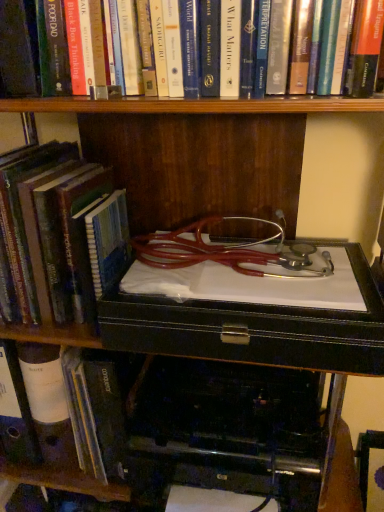
Describe the element at coordinates (255, 328) in the screenshot. The image size is (384, 512). I see `black plastic printer at lower center` at that location.

This screenshot has height=512, width=384. Describe the element at coordinates (92, 414) in the screenshot. I see `hardcover book at left, the 3th book viewed from the top` at that location.

Image resolution: width=384 pixels, height=512 pixels. Find the location of `black plastic printer at lower center`. black plastic printer at lower center is located at coordinates (255, 328).

Does hardcover book at left, which is the 1th book from bottom to top, touch hardcover book at upper center, which is the 1th book in top-to-bottom order?

No, hardcover book at left, which is the 1th book from bottom to top, is not in contact with hardcover book at upper center, which is the 1th book in top-to-bottom order.

Considering the positions of objects hardcover book at left, the 3th book viewed from the top, and hardcover book at upper center, the 3th book from the bottom, in the image provided, who is more to the right, hardcover book at left, the 3th book viewed from the top, or hardcover book at upper center, the 3th book from the bottom,?

From the viewer's perspective, hardcover book at upper center, the 3th book from the bottom, appears more on the right side.

Does hardcover book at left, which is the 1th book from bottom to top, have a greater width compared to hardcover book at upper center, which is the 1th book in top-to-bottom order?

Yes.

In the scene shown: Is hardcover book at left, which is the 1th book from bottom to top, oriented towards hardcover book at upper center, the 3th book from the bottom?

No, hardcover book at left, which is the 1th book from bottom to top, is not aimed at hardcover book at upper center, the 3th book from the bottom.

Considering the relative sizes of hardcover book at left, which is counted as the second book, starting from the top, and hardcover book at left, the 3th book viewed from the top, in the image provided, is hardcover book at left, which is counted as the second book, starting from the top, shorter than hardcover book at left, the 3th book viewed from the top,?

In fact, hardcover book at left, which is counted as the second book, starting from the top, may be taller than hardcover book at left, the 3th book viewed from the top.

Between hardcover book at left, which is counted as the second book, starting from the top, and hardcover book at left, which is the 1th book from bottom to top, which one is positioned behind?

hardcover book at left, which is the 1th book from bottom to top, is more distant.

Find the location of `book that is the 1st object above the hardcover book at left, the 3th book viewed from the top (from a real-world perspective)`. book that is the 1st object above the hardcover book at left, the 3th book viewed from the top (from a real-world perspective) is located at coordinates (80, 241).

Is hardcover book at left, which is counted as the second book, starting from the top, surrounded by hardcover book at upper center, which is the 1th book in top-to-bottom order?

No, hardcover book at left, which is counted as the second book, starting from the top, is located outside of hardcover book at upper center, which is the 1th book in top-to-bottom order.

Is hardcover book at upper center, the 3th book from the bottom, not near hardcover book at left, which is counted as the second book, starting from the top?

No, hardcover book at upper center, the 3th book from the bottom, is in close proximity to hardcover book at left, which is counted as the second book, starting from the top.

From the picture: From the image's perspective, between hardcover book at upper center, the 3th book from the bottom, and hardcover book at left, marked as the 2th book in a bottom-to-top arrangement, which one is located above?

hardcover book at upper center, the 3th book from the bottom, appears higher in the image.

Is black plastic printer at lower center situated inside hardcover book at left, the 3th book viewed from the top, or outside?

black plastic printer at lower center is spatially situated outside hardcover book at left, the 3th book viewed from the top.

Does black plastic printer at lower center turn towards hardcover book at left, which is the 1th book from bottom to top?

No, black plastic printer at lower center is not aimed at hardcover book at left, which is the 1th book from bottom to top.

Locate an element on the screen. book that appears behind the black plastic printer at lower center is located at coordinates (92, 414).

From a real-world perspective, does hardcover book at upper center, which is the 1th book in top-to-bottom order, sit lower than hardcover book at left, the 3th book viewed from the top?

Incorrect, from a real-world perspective, hardcover book at upper center, which is the 1th book in top-to-bottom order, is higher than hardcover book at left, the 3th book viewed from the top.

Is hardcover book at upper center, which is the 1th book in top-to-bottom order, next to hardcover book at left, which is the 1th book from bottom to top, and touching it?

There is a gap between hardcover book at upper center, which is the 1th book in top-to-bottom order, and hardcover book at left, which is the 1th book from bottom to top.

From the picture: Can you confirm if hardcover book at upper center, which is the 1th book in top-to-bottom order, is positioned to the right of hardcover book at left, the 3th book viewed from the top?

Yes.

In the image, is hardcover book at upper center, which is the 1th book in top-to-bottom order, positioned in front of or behind hardcover book at left, which is the 1th book from bottom to top?

In the image, hardcover book at upper center, which is the 1th book in top-to-bottom order, appears in front of hardcover book at left, which is the 1th book from bottom to top.

Is hardcover book at upper center, the 3th book from the bottom, facing away from black plastic printer at lower center?

No, hardcover book at upper center, the 3th book from the bottom,'s orientation is not away from black plastic printer at lower center.

The width and height of the screenshot is (384, 512). Find the location of `the 1st book to the left of the black plastic printer at lower center, counting from the anchor's position`. the 1st book to the left of the black plastic printer at lower center, counting from the anchor's position is located at coordinates (367, 48).

In the scene shown: Considering the sizes of hardcover book at upper center, which is the 1th book in top-to-bottom order, and black plastic printer at lower center in the image, is hardcover book at upper center, which is the 1th book in top-to-bottom order, taller or shorter than black plastic printer at lower center?

Clearly, hardcover book at upper center, which is the 1th book in top-to-bottom order, is shorter compared to black plastic printer at lower center.

Considering their positions, is hardcover book at upper center, the 3th book from the bottom, located in front of or behind black plastic printer at lower center?

Clearly, hardcover book at upper center, the 3th book from the bottom, is in front of black plastic printer at lower center.

Does point (207, 316) appear closer or farther from the camera than point (88, 179)?

Point (207, 316) is positioned closer to the camera compared to point (88, 179).

Do you think black plastic printer at lower center is within hardcover book at left, which is counted as the second book, starting from the top, or outside of it?

black plastic printer at lower center exists outside the volume of hardcover book at left, which is counted as the second book, starting from the top.

Could you tell me if black plastic printer at lower center is turned towards hardcover book at left, marked as the 2th book in a bottom-to-top arrangement?

No.

Is black plastic printer at lower center further to camera compared to hardcover book at left, marked as the 2th book in a bottom-to-top arrangement?

Yes, it is behind hardcover book at left, marked as the 2th book in a bottom-to-top arrangement.

Starting from the hardcover book at left, the 3th book viewed from the top, which book is the 2nd one in front? Please provide its 2D coordinates.

[(367, 48)]

Identify the location of book behind the hardcover book at left, which is counted as the second book, starting from the top. This screenshot has height=512, width=384. (92, 414).

Considering their positions, is hardcover book at left, which is the 1th book from bottom to top, positioned further to hardcover book at left, which is counted as the second book, starting from the top, than black plastic printer at lower center?

The object further to hardcover book at left, which is counted as the second book, starting from the top, is hardcover book at left, which is the 1th book from bottom to top.

When comparing their distances from black plastic printer at lower center, does hardcover book at upper center, the 3th book from the bottom, or hardcover book at left, marked as the 2th book in a bottom-to-top arrangement, seem further?

Based on the image, hardcover book at upper center, the 3th book from the bottom, appears to be further to black plastic printer at lower center.

From the image, which object appears to be farther from hardcover book at upper center, the 3th book from the bottom, hardcover book at left, the 3th book viewed from the top, or hardcover book at left, which is counted as the second book, starting from the top?

hardcover book at left, the 3th book viewed from the top, is positioned further to the anchor hardcover book at upper center, the 3th book from the bottom.

Which object lies further to the anchor point hardcover book at left, which is the 1th book from bottom to top, black plastic printer at lower center or hardcover book at upper center, the 3th book from the bottom?

hardcover book at upper center, the 3th book from the bottom, is positioned further to the anchor hardcover book at left, which is the 1th book from bottom to top.

Estimate the real-world distances between objects in this image. Which object is further from hardcover book at upper center, the 3th book from the bottom, hardcover book at left, the 3th book viewed from the top, or black plastic printer at lower center?

The object further to hardcover book at upper center, the 3th book from the bottom, is hardcover book at left, the 3th book viewed from the top.

Looking at the image, which one is located further to black plastic printer at lower center, hardcover book at left, which is the 1th book from bottom to top, or hardcover book at left, marked as the 2th book in a bottom-to-top arrangement?

The object further to black plastic printer at lower center is hardcover book at left, which is the 1th book from bottom to top.

Which object lies nearer to the anchor point hardcover book at left, the 3th book viewed from the top, hardcover book at upper center, the 3th book from the bottom, or hardcover book at left, marked as the 2th book in a bottom-to-top arrangement?

hardcover book at left, marked as the 2th book in a bottom-to-top arrangement, lies closer to hardcover book at left, the 3th book viewed from the top, than the other object.

Which object lies nearer to the anchor point hardcover book at left, marked as the 2th book in a bottom-to-top arrangement, black plastic printer at lower center or hardcover book at left, which is the 1th book from bottom to top?

black plastic printer at lower center lies closer to hardcover book at left, marked as the 2th book in a bottom-to-top arrangement, than the other object.

Where is `book between hardcover book at upper center, which is the 1th book in top-to-bottom order, and hardcover book at left, which is the 1th book from bottom to top, in the vertical direction`? book between hardcover book at upper center, which is the 1th book in top-to-bottom order, and hardcover book at left, which is the 1th book from bottom to top, in the vertical direction is located at coordinates (80, 241).

The height and width of the screenshot is (512, 384). In order to click on book between hardcover book at left, marked as the 2th book in a bottom-to-top arrangement, and black plastic printer at lower center, in the vertical direction in this screenshot , I will do `click(92, 414)`.